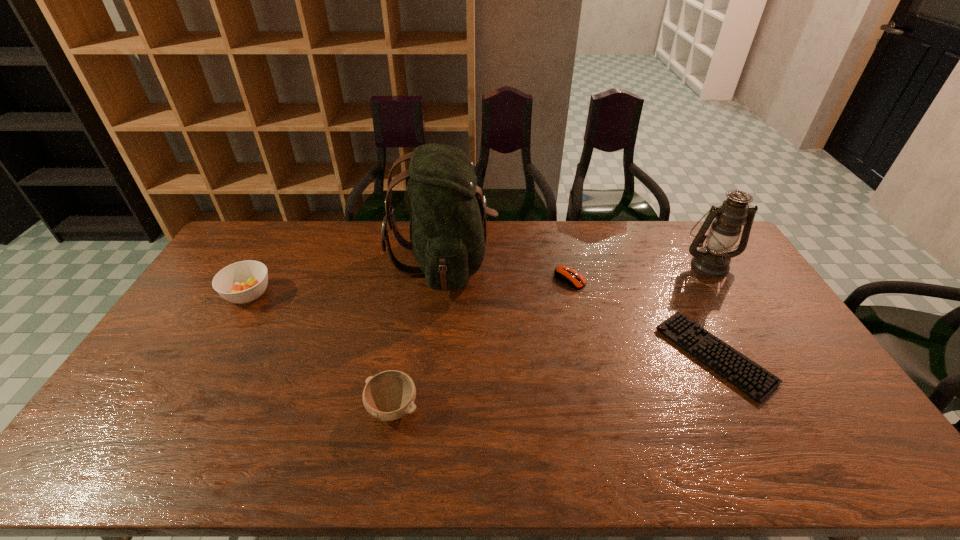
Identify the location of the tallest object. The image size is (960, 540). (448, 230).

In order to click on the second tallest object in this screenshot , I will do `click(713, 260)`.

Locate an element on the screen. This screenshot has height=540, width=960. soup bowl is located at coordinates (241, 282).

Identify the location of bowl. Image resolution: width=960 pixels, height=540 pixels. (389, 395).

You are a GUI agent. You are given a task and a screenshot of the screen. Output one action in this format:
    pyautogui.click(x=<x>, y=<y>)
    Task: Click on the computer mouse
    The width and height of the screenshot is (960, 540).
    Given the screenshot: What is the action you would take?
    point(565,274)

The image size is (960, 540). What are the coordinates of `the third object from right to left` in the screenshot? It's located at (565, 274).

Locate an element on the screen. The height and width of the screenshot is (540, 960). the shortest object is located at coordinates (746, 375).

The image size is (960, 540). I want to click on free space located on the open flap of the tallest object, so click(x=595, y=261).

Where is `free space located on the front of the second tallest object`? This screenshot has width=960, height=540. free space located on the front of the second tallest object is located at coordinates (769, 361).

Where is `vacant area situated 0.270m on the back of the soup bowl`? This screenshot has height=540, width=960. vacant area situated 0.270m on the back of the soup bowl is located at coordinates (283, 234).